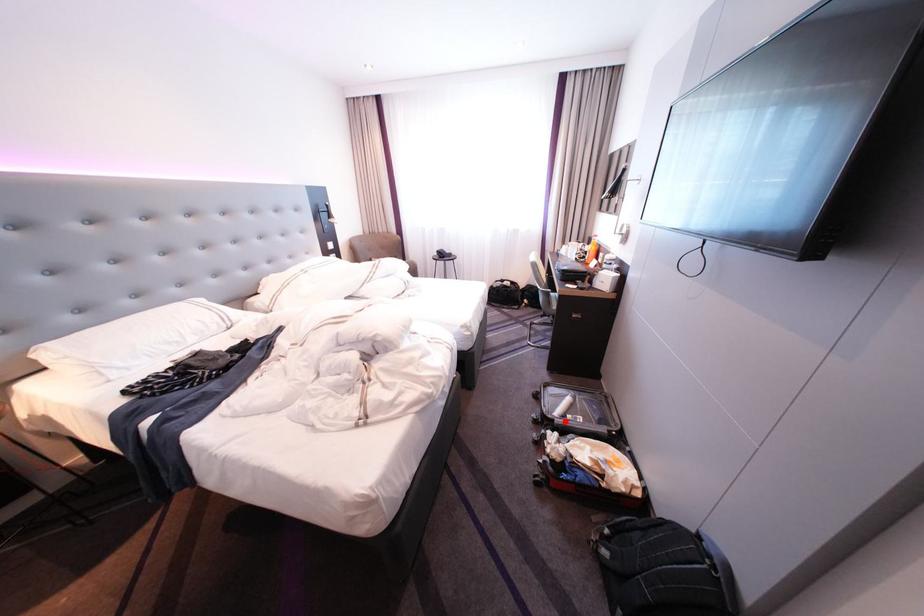
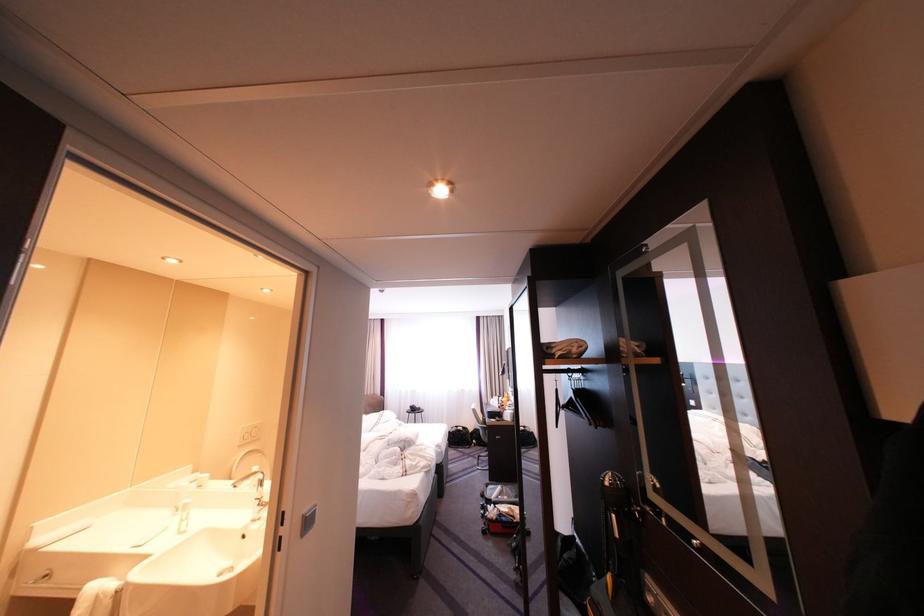
Question: I am providing you with two images of the same scene from different viewpoints. In image1, a red point is highlighted. Considering the same 3D point in image2, which of the following is correct?

Choices:
 (A) It is closer
 (B) It is farther

Answer: (A)